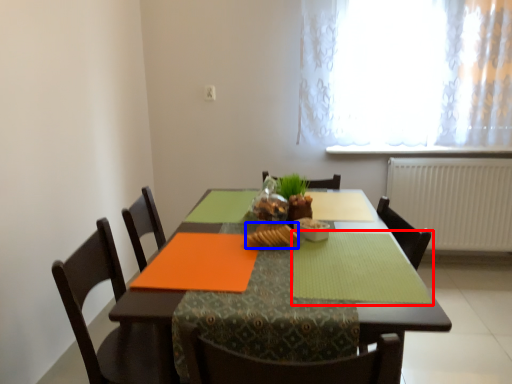
Question: Which object is further to the camera taking this photo, place mat (highlighted by a red box) or food (highlighted by a blue box)?

Choices:
 (A) place mat
 (B) food

Answer: (B)